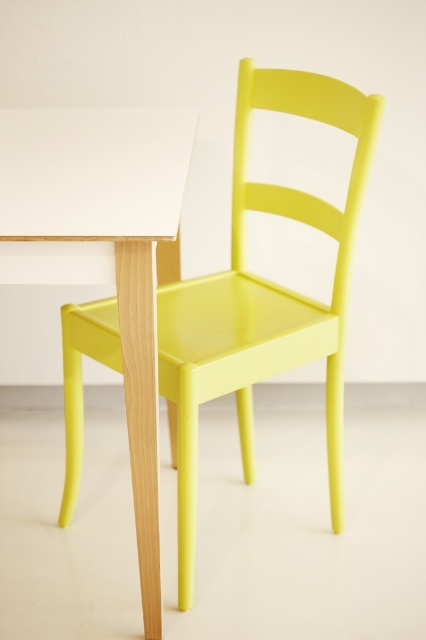
You are organizing a small event and need to place a 1.5 meter long banner between the lime matte chair at center and the white matte table at center. Considering their sizes, will the banner fit horizontally between them without overlapping either object?

The lime matte chair at center is bigger than the white matte table at center. Since the banner is 1.5 meters long, it might not fit horizontally between them if the distance between the two objects is less than 1.5 meters. However, the provided information does not specify the exact distance between them, so we cannot determine if the banner will fit based solely on their sizes.